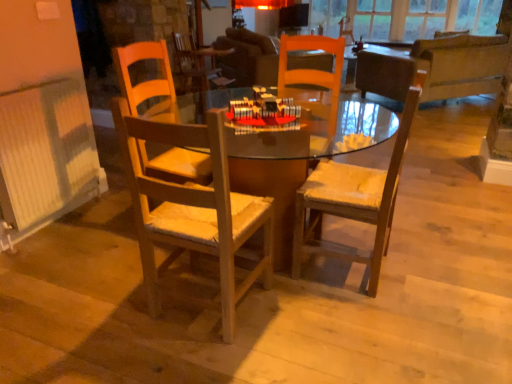
Question: Does wooden chair with cushion at center, which is counted as the second chair, starting from the left, turn towards wooden table at center?

Choices:
 (A) yes
 (B) no

Answer: (A)

Question: Is wooden table at center located within wooden chair with cushion at center, which is the first chair from right to left?

Choices:
 (A) yes
 (B) no

Answer: (B)

Question: Is wooden chair with cushion at center, which is the first chair from right to left, not near wooden table at center?

Choices:
 (A) no
 (B) yes

Answer: (A)

Question: From a real-world perspective, is wooden chair with cushion at center, which is counted as the second chair, starting from the left, physically above wooden table at center?

Choices:
 (A) no
 (B) yes

Answer: (B)

Question: Does wooden chair with cushion at center, which is counted as the second chair, starting from the left, come in front of wooden table at center?

Choices:
 (A) yes
 (B) no

Answer: (B)

Question: Does wooden chair with cushion at center, which is counted as the second chair, starting from the left, have a greater width compared to wooden table at center?

Choices:
 (A) yes
 (B) no

Answer: (B)

Question: Does wooden table at center have a greater width compared to wooden chair with cushion at center, which is the first chair from right to left?

Choices:
 (A) yes
 (B) no

Answer: (A)

Question: From a real-world perspective, does wooden table at center stand above wooden chair with cushion at center, which is counted as the second chair, starting from the left?

Choices:
 (A) yes
 (B) no

Answer: (B)

Question: From the image's perspective, would you say wooden table at center is shown under wooden chair with cushion at center, which is counted as the second chair, starting from the left?

Choices:
 (A) no
 (B) yes

Answer: (B)

Question: Are wooden table at center and wooden chair with cushion at center, which is the first chair from right to left, beside each other?

Choices:
 (A) yes
 (B) no

Answer: (B)

Question: Is wooden table at center positioned behind wooden chair with cushion at center, which is the first chair from right to left?

Choices:
 (A) yes
 (B) no

Answer: (B)

Question: Does wooden table at center have a smaller size compared to wooden chair with cushion at center, which is the first chair from right to left?

Choices:
 (A) no
 (B) yes

Answer: (A)

Question: Can you confirm if wooden chair with cushion at center, which is the first chair from right to left, is positioned to the right of dark brown leather couch at upper right?

Choices:
 (A) yes
 (B) no

Answer: (B)